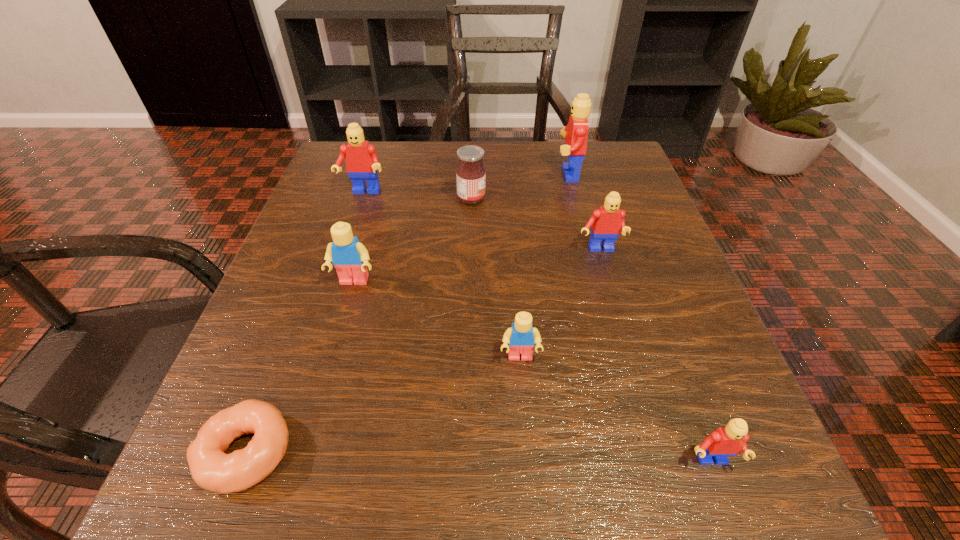
Select which Lego is the fifth closest to the nearest Lego. Please provide its 2D coordinates. Your answer should be formatted as a tuple, i.e. [(x, y)], where the tuple contains the x and y coordinates of a point satisfying the conditions above.

[(362, 163)]

I want to click on red Lego that is the third closest one to the biggest red Lego, so click(730, 440).

Identify which red Lego is the third nearest to the smaller yellow Lego. Please provide its 2D coordinates. Your answer should be formatted as a tuple, i.e. [(x, y)], where the tuple contains the x and y coordinates of a point satisfying the conditions above.

[(575, 133)]